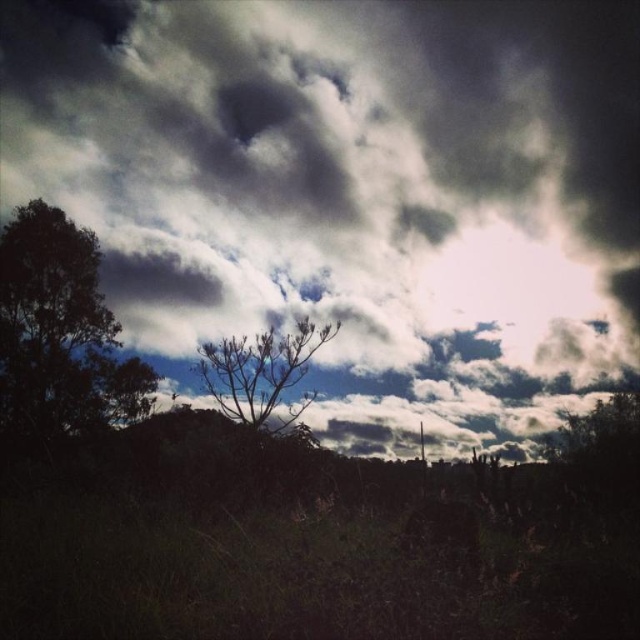
You are an astronomer analyzing the image of the sky. You notice two points of interest labeled as point [460,195] and point [8,276]. Which point is closer to your observation equipment?

Point [460,195] is further to the viewer than point [8,276], so the point closer to the observation equipment is point [8,276].

You are an artist trying to paint the scene. You want to ensure the dark green leafy tree at left is proportionally smaller than the dark cloudy sky at upper center in your painting. Is this accurate based on the actual scene?

Yes, the dark cloudy sky at upper center is much taller than the dark green leafy tree at left, so painting it proportionally smaller would be accurate.